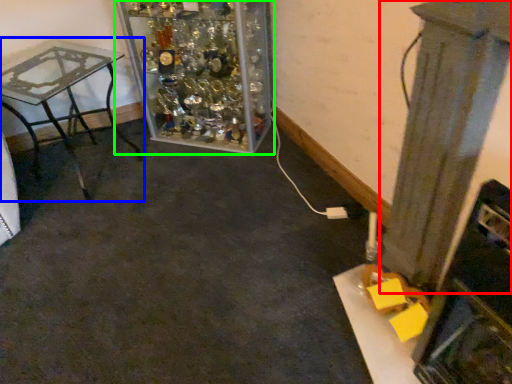
Question: Which is farther away from pillar (highlighted by a red box)? table (highlighted by a blue box) or furniture (highlighted by a green box)?

Choices:
 (A) table
 (B) furniture

Answer: (A)